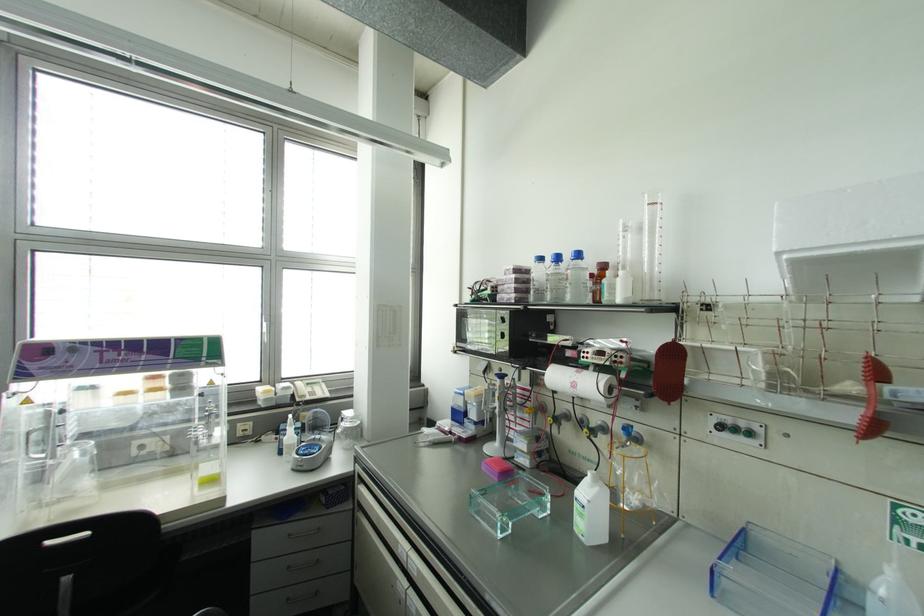
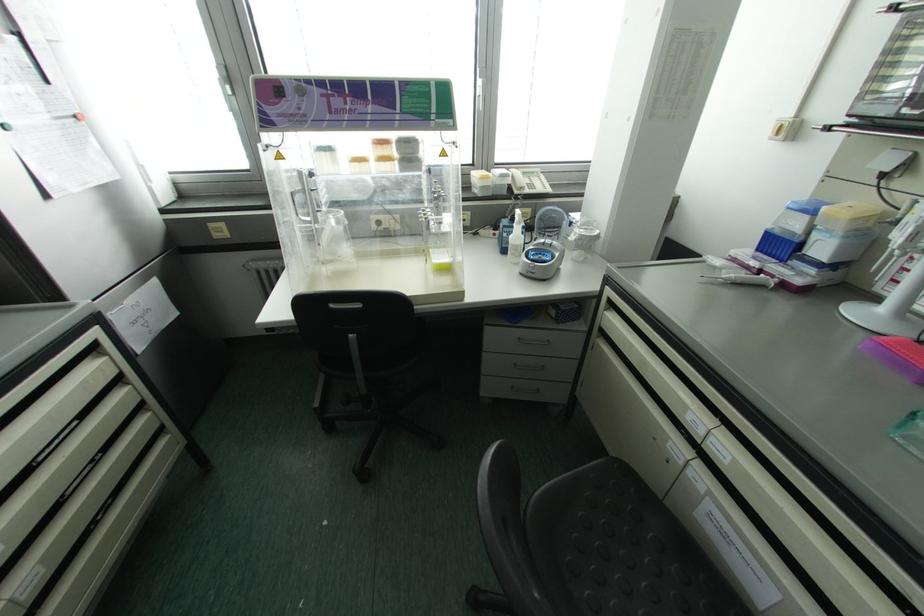
Where in the second image is the point corresponding to (x=322, y=440) from the first image?

(553, 246)